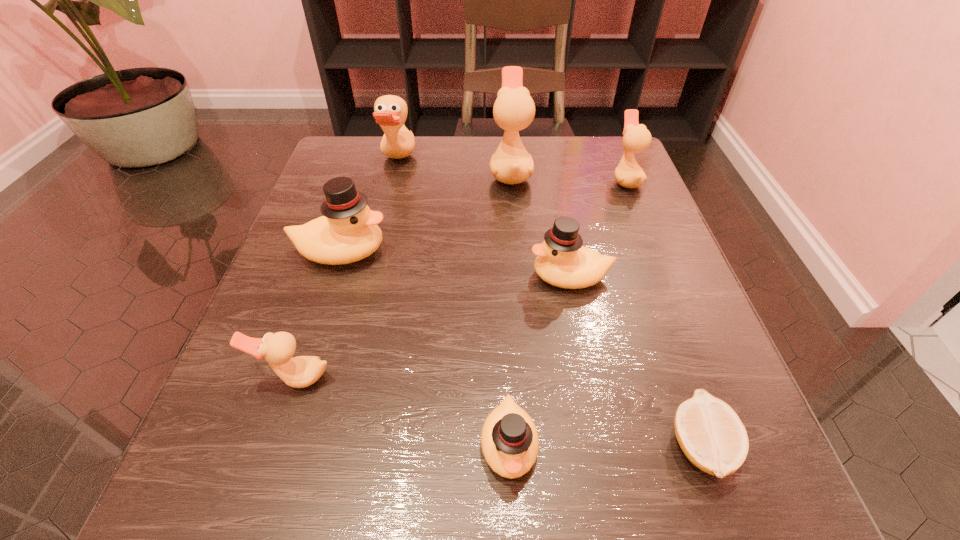
Find the location of a particular element. object that is at the far right corner is located at coordinates (636, 138).

Image resolution: width=960 pixels, height=540 pixels. I want to click on object at the near right corner, so click(711, 435).

Identify the location of vacant space at the far edge of the desktop. This screenshot has height=540, width=960. (393, 188).

The height and width of the screenshot is (540, 960). In the image, there is a desktop. What are the coordinates of `vacant area at the near edge` in the screenshot? It's located at (630, 490).

Find the location of `free space at the left edge of the desktop`. free space at the left edge of the desktop is located at coordinates 315,385.

The width and height of the screenshot is (960, 540). What are the coordinates of `blank space at the right edge of the desktop` in the screenshot? It's located at point(657,310).

Locate an element on the screen. free space at the far left corner of the desktop is located at coordinates (362, 150).

In the image, there is a desktop. Identify the location of vacant space at the near left corner. click(x=183, y=491).

You are a GUI agent. You are given a task and a screenshot of the screen. Output one action in this format:
    pyautogui.click(x=<x>, y=<y>)
    Task: Click on the vacant area that lies between the biggest yellow duck and the second biggest tan duck
    
    Given the screenshot: What is the action you would take?
    pyautogui.click(x=370, y=206)

The width and height of the screenshot is (960, 540). In order to click on vacant area between the second biggest tan duck and the second yellow duck from left to right in this screenshot , I will do `click(453, 303)`.